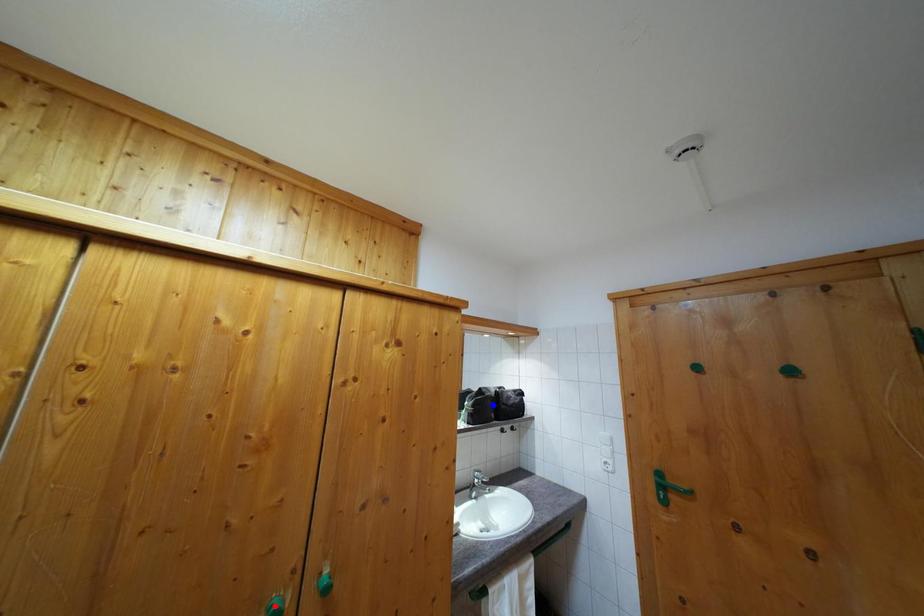
Question: Two points are marked on the image. Which point is closer to the camera?

Choices:
 (A) Blue point is closer.
 (B) Red point is closer.

Answer: (B)